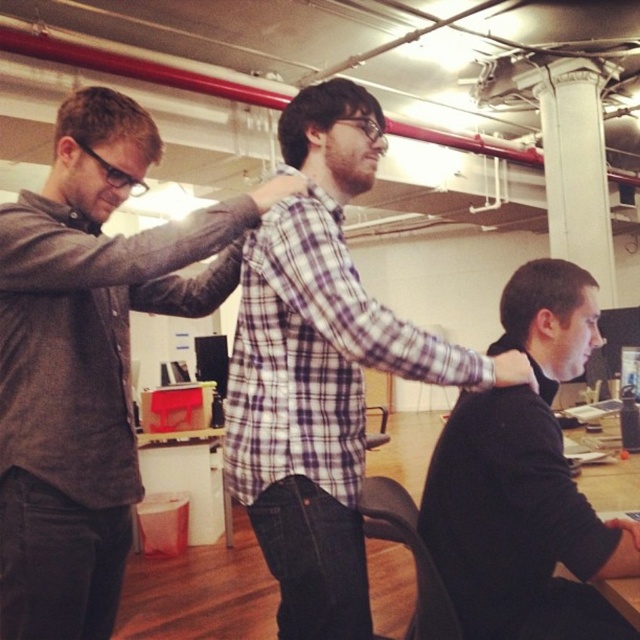
Consider the image. You are an office assistant who needs to hand out two different colored folders to the two people in the scene. The gray matte shirt at center should get the folder labeled LEFT, and the black sweater at center should get the folder labeled RIGHT. Based on their positions, which person should receive which folder?

The gray matte shirt at center is to the left of the black sweater at center, so the gray matte shirt at center should receive the LEFT folder, and the black sweater at center should receive the RIGHT folder.

You are an office manager planning to place a new 12 inch wide plant pot between the gray matte shirt at center and the white smooth column at upper center. Based on their widths, will there be enough space for the plant pot?

The gray matte shirt at center is narrower than the white smooth column at upper center. However, since the exact distance between them isn not provided, we cannot determine if there is sufficient space for the 12 inch wide plant pot.

You are a tailor in this office scene. You need to hang both the plaid shirt at center and the black sweater at center on a rack. The rack has a height limit of 30 cm. Can both items be hung without exceeding the rack height limit?

The plaid shirt at center is taller than the black sweater at center. If the plaid shirt at center exceeds 30 cm in height, then it cannot be hung on the rack. However, since the exact heights are not provided, we cannot definitively determine if both items will fit within the 30 cm limit.